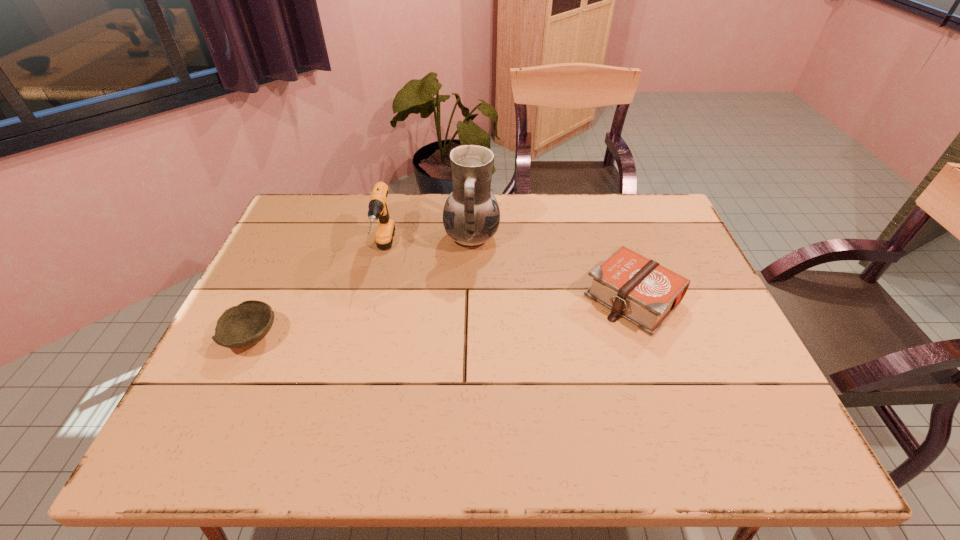
Locate an element on the screen. This screenshot has width=960, height=540. the second object from right to left is located at coordinates (471, 215).

What are the coordinates of `the tallest object` in the screenshot? It's located at (471, 215).

The width and height of the screenshot is (960, 540). I want to click on drill, so click(378, 209).

Find the location of a particular element. The height and width of the screenshot is (540, 960). the second tallest object is located at coordinates (378, 209).

Image resolution: width=960 pixels, height=540 pixels. I want to click on the rightmost object, so 640,290.

You are a GUI agent. You are given a task and a screenshot of the screen. Output one action in this format:
    pyautogui.click(x=<x>, y=<y>)
    Task: Click on the second shortest object
    Image resolution: width=960 pixels, height=540 pixels.
    Given the screenshot: What is the action you would take?
    640,290

You are a GUI agent. You are given a task and a screenshot of the screen. Output one action in this format:
    pyautogui.click(x=<x>, y=<y>)
    Task: Click on the shortest object
    
    Given the screenshot: What is the action you would take?
    pyautogui.click(x=241, y=326)

Find the location of a particular element. The height and width of the screenshot is (540, 960). the leftmost object is located at coordinates (241, 326).

This screenshot has height=540, width=960. Find the location of `vacant point located 0.390m on the front-facing side of the tallest object`. vacant point located 0.390m on the front-facing side of the tallest object is located at coordinates (628, 238).

This screenshot has height=540, width=960. What are the coordinates of `vacant point located 0.390m at the tip of the third shortest object` in the screenshot? It's located at (347, 407).